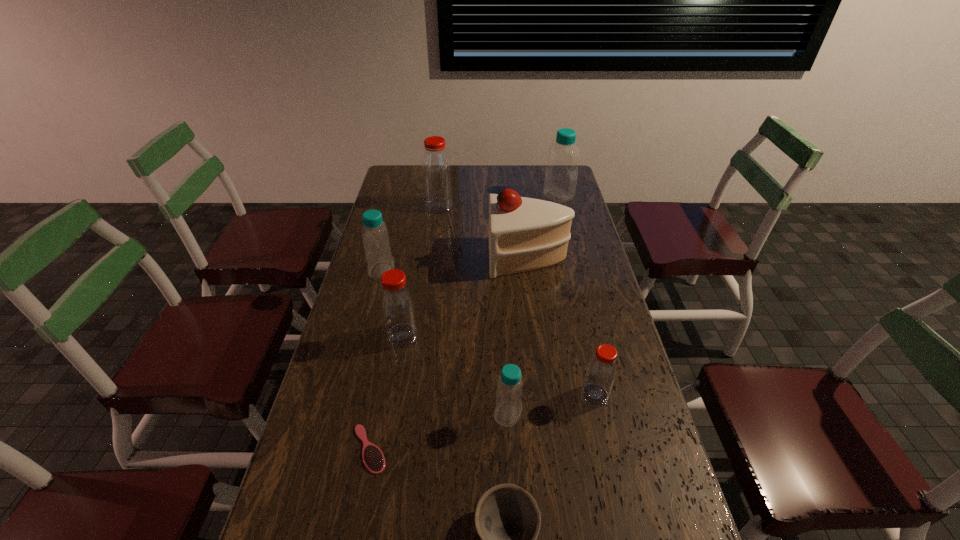
I want to click on vacant space that's between the shortest object and the second biggest red bottle, so [386, 392].

You are a GUI agent. You are given a task and a screenshot of the screen. Output one action in this format:
    pyautogui.click(x=<x>, y=<y>)
    Task: Click on the vacant space that's between the biggest red bottle and the cake
    This screenshot has height=540, width=960.
    Given the screenshot: What is the action you would take?
    [x=484, y=232]

Find the location of a particular element. empty space between the cake and the fourth bottle from left to right is located at coordinates (518, 336).

The width and height of the screenshot is (960, 540). What are the coordinates of `free space that is in between the smallest blue bottle and the rightmost red bottle` in the screenshot? It's located at (551, 404).

Identify the location of vacant space in between the second nearest red bottle and the farthest red bottle. (420, 271).

At what (x,y) coordinates should I click in order to perform the action: click on vacant space that is in between the biggest red bottle and the smallest red bottle. Please return your answer as a coordinate pair (x, y). Looking at the image, I should click on (517, 300).

Find the location of `free space that is in between the second biggest red bottle and the farthest blue bottle`. free space that is in between the second biggest red bottle and the farthest blue bottle is located at coordinates (481, 266).

Find the location of `object that is the second closest to the gray bowl`. object that is the second closest to the gray bowl is located at coordinates (373, 458).

Locate an element on the screen. The image size is (960, 540). the eighth closest object to the rightmost blue bottle is located at coordinates (507, 519).

Point out which bottle is positioned as the fourth nearest to the eighth tallest object. Please provide its 2D coordinates. Your answer should be formatted as a tuple, i.e. [(x, y)], where the tuple contains the x and y coordinates of a point satisfying the conditions above.

[(375, 235)]